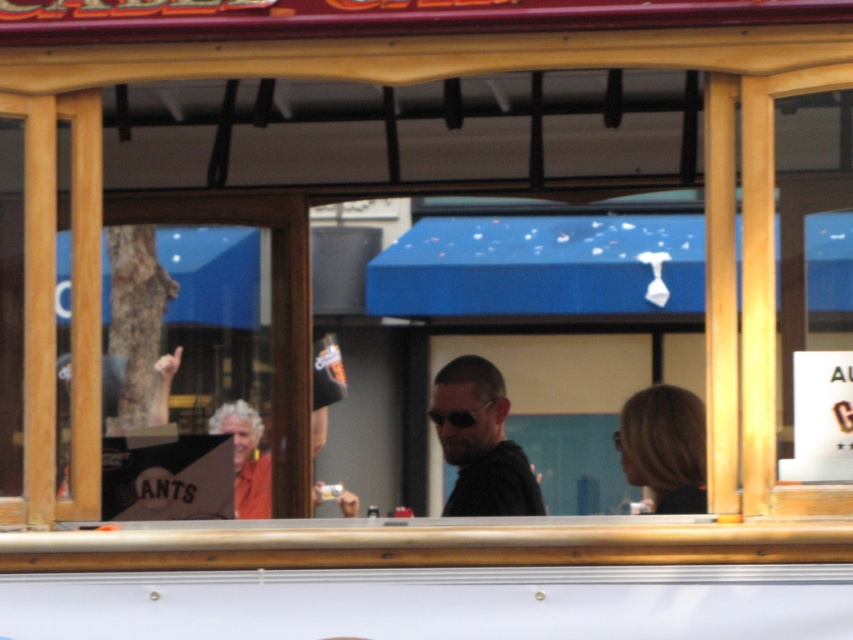
Who is taller, blonde hair at center or sunglasses at center?

blonde hair at center

You are a GUI agent. You are given a task and a screenshot of the screen. Output one action in this format:
    pyautogui.click(x=<x>, y=<y>)
    Task: Click on the blonde hair at center
    
    Given the screenshot: What is the action you would take?
    pyautogui.click(x=664, y=448)

You are a GUI agent. You are given a task and a screenshot of the screen. Output one action in this format:
    pyautogui.click(x=<x>, y=<y>)
    Task: Click on the blonde hair at center
    The image size is (853, 640).
    Given the screenshot: What is the action you would take?
    pyautogui.click(x=664, y=448)

Does point (483, 401) come farther from viewer compared to point (675, 458)?

Yes, it is.

Who is higher up, black matte sunglasses at center or blonde hair at center?

blonde hair at center is above.

What do you see at coordinates (480, 442) in the screenshot?
I see `black matte sunglasses at center` at bounding box center [480, 442].

Identify the location of black matte sunglasses at center. (480, 442).

Based on the photo, is black matte sunglasses at center positioned at the back of sunglasses at center?

That is False.

Is black matte sunglasses at center above sunglasses at center?

No, black matte sunglasses at center is not above sunglasses at center.

Locate an element on the screen. black matte sunglasses at center is located at coordinates (480, 442).

Where is `black matte sunglasses at center`? The width and height of the screenshot is (853, 640). black matte sunglasses at center is located at coordinates (480, 442).